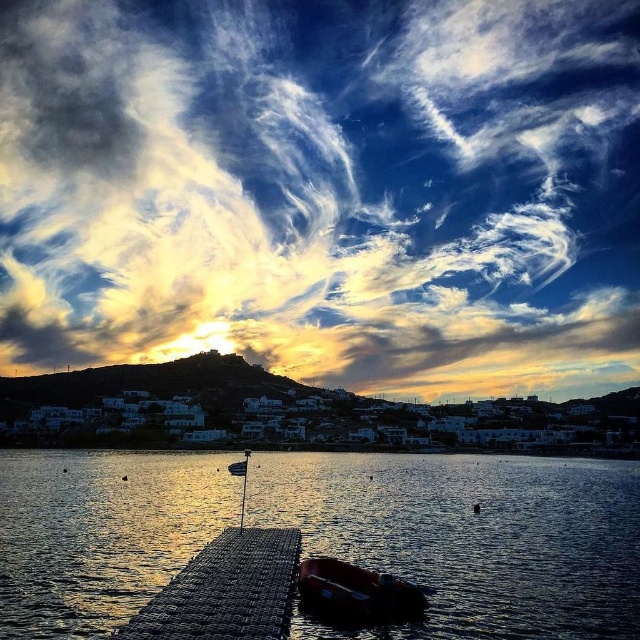
Based on the photo, you are standing at a point labeled as point (109, 355) in the coastal scene. If you want to take a photo of the sunset, which direction should you face?

Since the point (109, 355) is 413.79 meters away from the camera, you should face towards the direction of the sunset, which is likely west or the direction where the sun is setting in the image.

You are standing at the dock center looking out at the glistening water. There is a point marked at coordinates [468,536]. Where is this point located in relation to the dock and the water?

The point at coordinates [468,536] is located on the glistening water at dock center, meaning it is situated precisely where the dock meets the water surface.